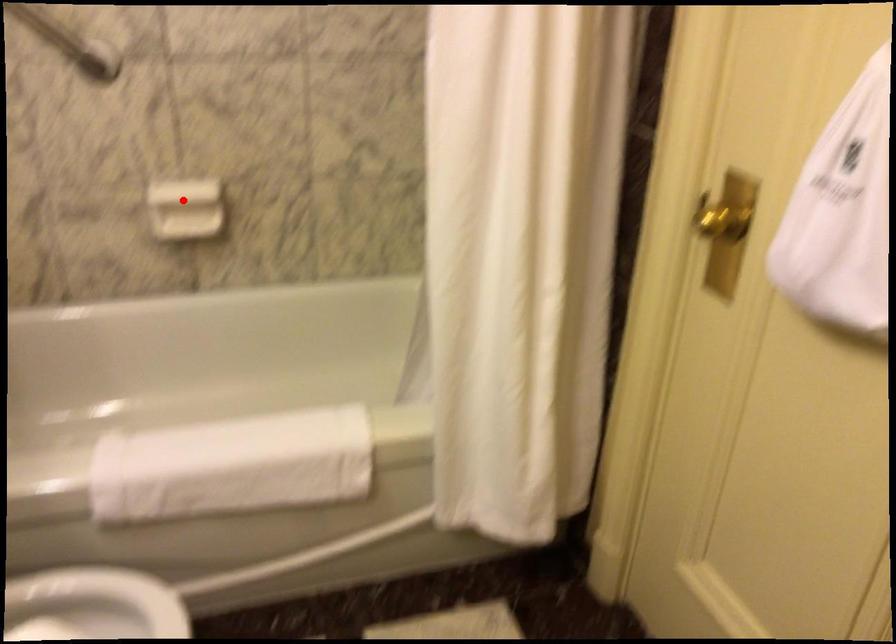
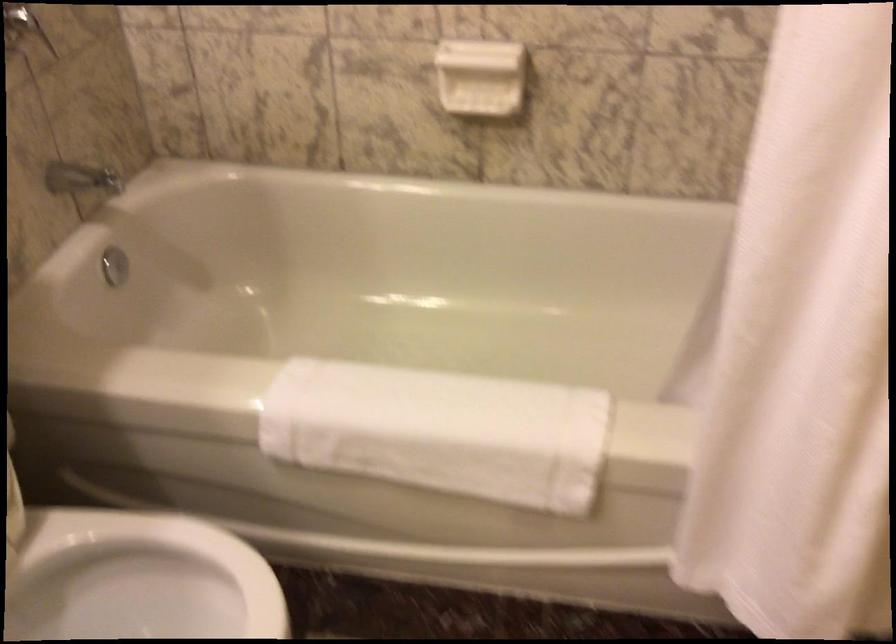
Question: I am providing you with two images of the same scene from different viewpoints. In image1, a red point is highlighted. Considering the same 3D point in image2, which of the following is correct?

Choices:
 (A) It is closer
 (B) It is farther

Answer: (A)